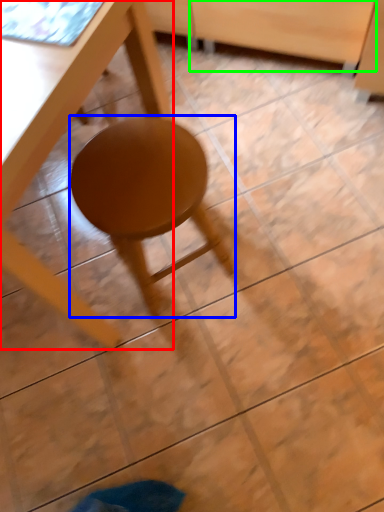
Question: Considering the real-world distances, which object is farthest from table (highlighted by a red box)? stool (highlighted by a blue box) or drawer (highlighted by a green box)?

Choices:
 (A) stool
 (B) drawer

Answer: (B)